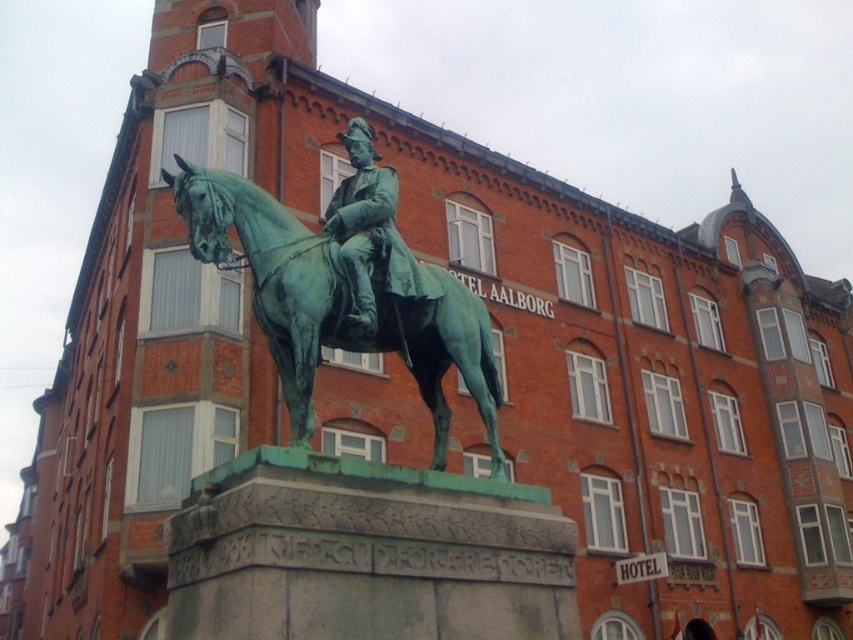
You are standing at point A, which is at coordinates point [363,314]. You want to move to point B, which is at coordinates point [450,285]. Which direction should you move to reach point B from point A?

To reach point B from point A, you should move towards the north because point [450,285] is behind point [363,314].

You are standing in front of the building and want to take a photo of the green patina horse at center and the green patina bronze statue at center. Which object should you focus on first if you want to capture both in the same frame without moving your camera?

You should focus on the green patina bronze statue at center first because the green patina horse at center is positioned under it, so adjusting focus to the statue ensures both are in the frame.